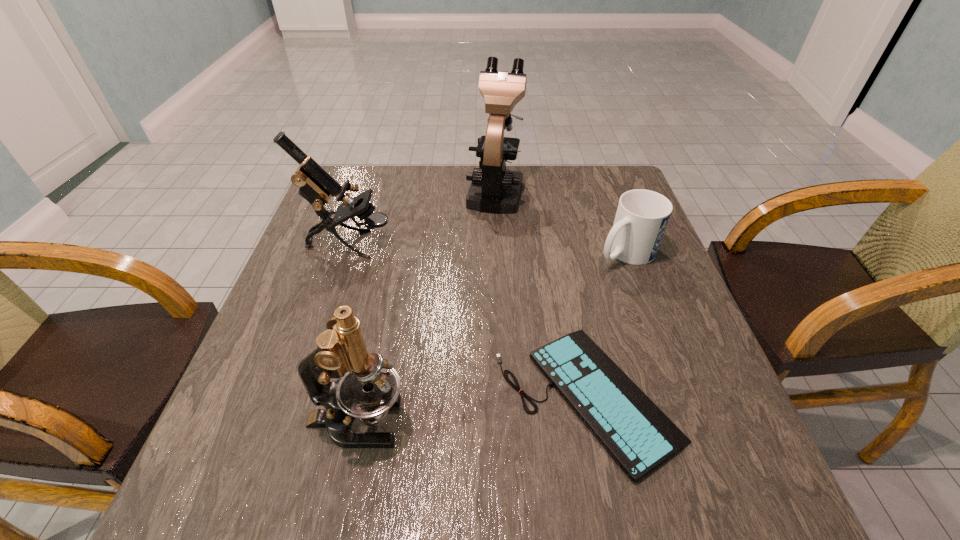
This screenshot has width=960, height=540. What are the coordinates of `free space at the far left corner of the desktop` in the screenshot? It's located at (365, 189).

In the image, there is a desktop. Where is `free space at the near left corner`? free space at the near left corner is located at coordinates (218, 461).

In the image, there is a desktop. At what (x,y) coordinates should I click in order to perform the action: click on vacant space at the far right corner. Please return your answer as a coordinate pair (x, y). This screenshot has width=960, height=540. Looking at the image, I should click on (588, 183).

The image size is (960, 540). Find the location of `unoccupied position between the second shortest object and the nearest microscope`. unoccupied position between the second shortest object and the nearest microscope is located at coordinates (492, 337).

You are a GUI agent. You are given a task and a screenshot of the screen. Output one action in this format:
    pyautogui.click(x=<x>, y=<y>)
    Task: Click on the vacant space that is in between the computer keyboard and the mug
    This screenshot has width=960, height=540.
    Given the screenshot: What is the action you would take?
    pyautogui.click(x=606, y=324)

I want to click on free area in between the second nearest microscope and the computer keyboard, so [468, 320].

The width and height of the screenshot is (960, 540). What are the coordinates of `unoccupied position between the nearest microscope and the mug` in the screenshot? It's located at (492, 337).

At what (x,y) coordinates should I click in order to perform the action: click on free area in between the second farthest microscope and the farthest microscope. Please return your answer as a coordinate pair (x, y). Looking at the image, I should click on pos(422,217).

Locate an element on the screen. The width and height of the screenshot is (960, 540). vacant area that lies between the mug and the second farthest microscope is located at coordinates (488, 248).

The image size is (960, 540). I want to click on vacant area that lies between the nearest microscope and the farthest microscope, so click(426, 306).